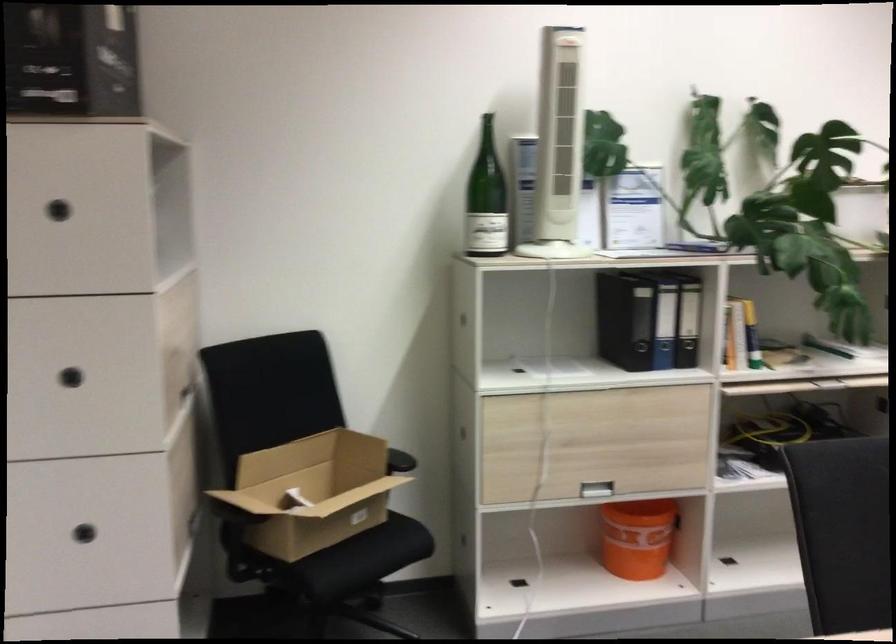
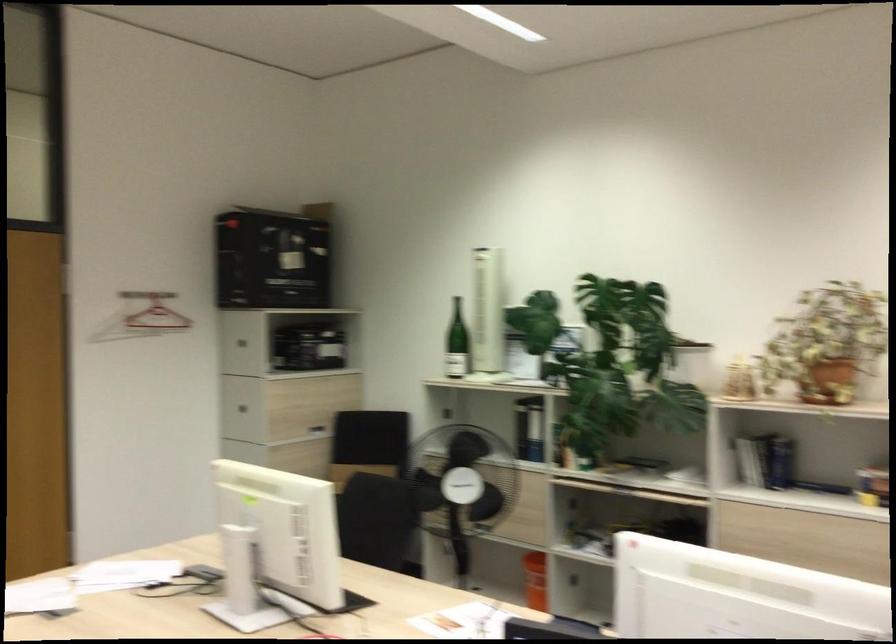
Question: I am providing you with two images of the same scene from different viewpoints. After the viewpoint changes to image2, which objects are now occluded?

Choices:
 (A) black binder
 (B) drawer pull
 (C) open cardboard box
 (D) metal door plate

Answer: (C)